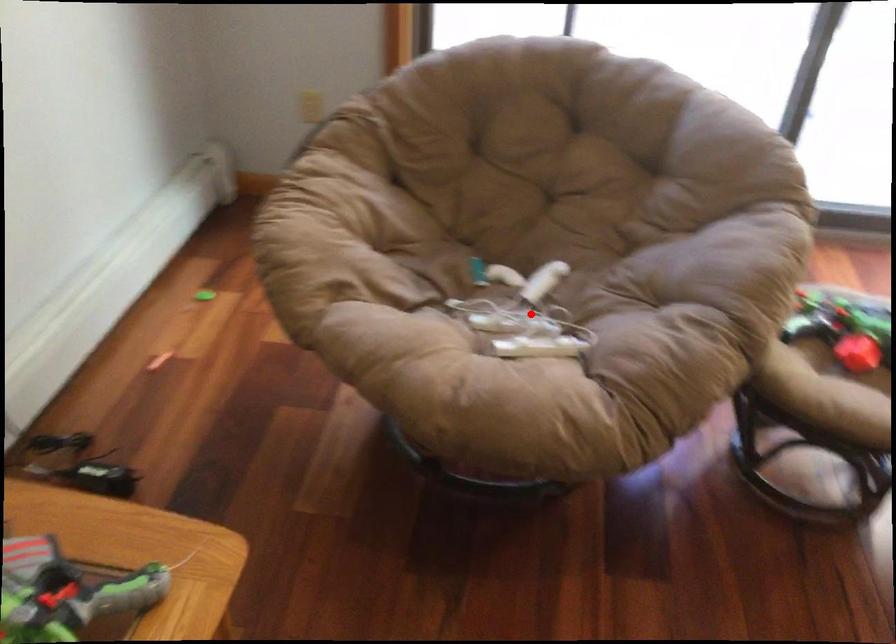
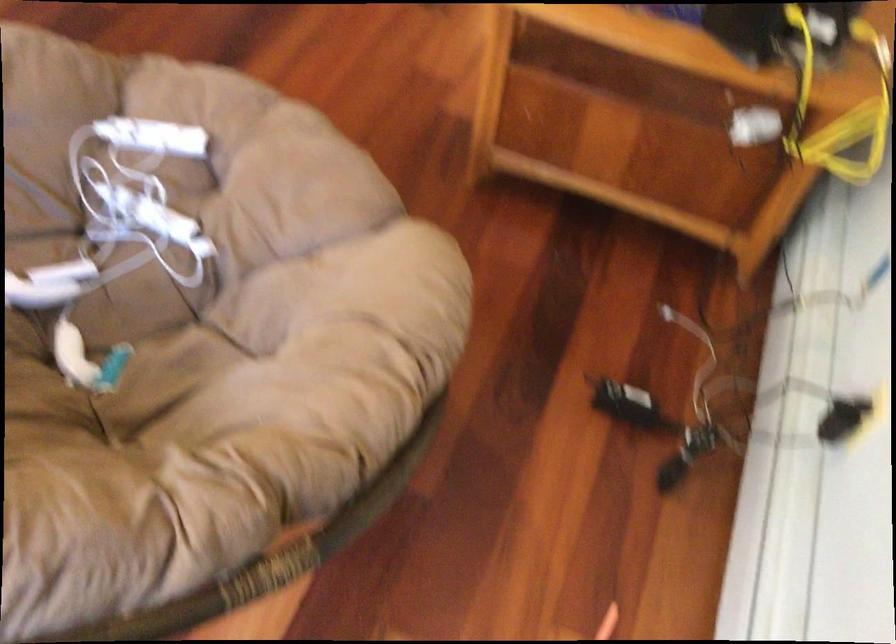
Question: I am providing you with two images of the same scene from different viewpoints. In image1, a red point is highlighted. Considering the same 3D point in image2, which of the following is correct?

Choices:
 (A) It is closer
 (B) It is farther

Answer: (A)